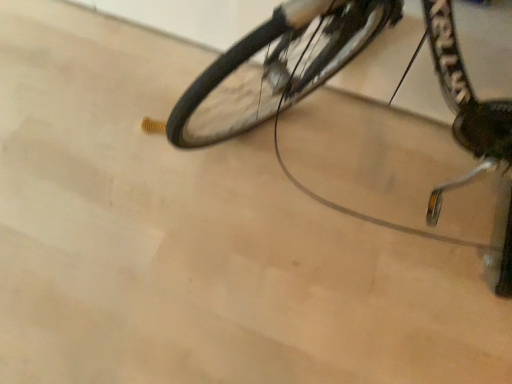
Question: From the image's perspective, is black rubber tire at center positioned above or below black rubber bicycle at center?

Choices:
 (A) below
 (B) above

Answer: (B)

Question: Considering the positions of point 245,51 and point 226,114, is point 245,51 closer or farther from the camera than point 226,114?

Choices:
 (A) farther
 (B) closer

Answer: (B)

Question: Is black rubber tire at center wider or thinner than black rubber bicycle at center?

Choices:
 (A) wide
 (B) thin

Answer: (B)

Question: From the image's perspective, relative to black rubber tire at center, is black rubber bicycle at center above or below?

Choices:
 (A) below
 (B) above

Answer: (A)

Question: From a real-world perspective, is black rubber bicycle at center positioned above or below black rubber tire at center?

Choices:
 (A) below
 (B) above

Answer: (B)

Question: Is black rubber bicycle at center bigger or smaller than black rubber tire at center?

Choices:
 (A) small
 (B) big

Answer: (B)

Question: Is black rubber bicycle at center in front of or behind black rubber tire at center in the image?

Choices:
 (A) front
 (B) behind

Answer: (A)